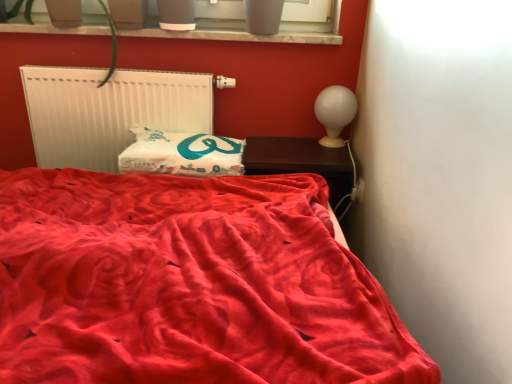
Question: Is smooth concrete window sill at upper center thinner than velvet red bed at center?

Choices:
 (A) no
 (B) yes

Answer: (B)

Question: Is smooth concrete window sill at upper center oriented away from velvet red bed at center?

Choices:
 (A) yes
 (B) no

Answer: (B)

Question: Does smooth concrete window sill at upper center lie in front of velvet red bed at center?

Choices:
 (A) no
 (B) yes

Answer: (A)

Question: From the image's perspective, is smooth concrete window sill at upper center below velvet red bed at center?

Choices:
 (A) no
 (B) yes

Answer: (A)

Question: From a real-world perspective, is smooth concrete window sill at upper center located beneath velvet red bed at center?

Choices:
 (A) yes
 (B) no

Answer: (B)

Question: Does smooth concrete window sill at upper center appear on the left side of velvet red bed at center?

Choices:
 (A) yes
 (B) no

Answer: (A)

Question: Is dark wood nightstand at right looking in the opposite direction of velvet red bed at center?

Choices:
 (A) yes
 (B) no

Answer: (B)

Question: Can you confirm if dark wood nightstand at right is taller than velvet red bed at center?

Choices:
 (A) no
 (B) yes

Answer: (A)

Question: Is dark wood nightstand at right with velvet red bed at center?

Choices:
 (A) no
 (B) yes

Answer: (A)

Question: Is dark wood nightstand at right facing towards velvet red bed at center?

Choices:
 (A) no
 (B) yes

Answer: (B)

Question: From the image's perspective, does dark wood nightstand at right appear higher than velvet red bed at center?

Choices:
 (A) no
 (B) yes

Answer: (B)

Question: Is there a large distance between dark wood nightstand at right and velvet red bed at center?

Choices:
 (A) no
 (B) yes

Answer: (A)

Question: Is velvet red bed at center thinner than white matte radiator at upper left?

Choices:
 (A) no
 (B) yes

Answer: (A)